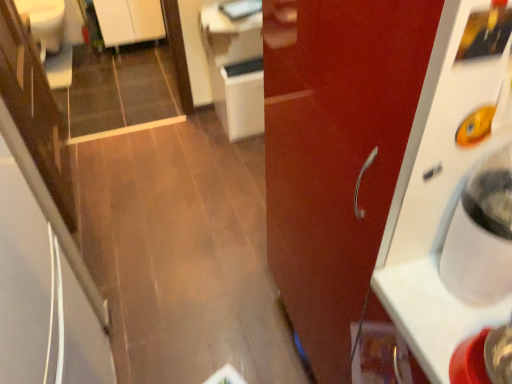
Question: Is glossy wood door at right a part of white glossy counter top at upper center?

Choices:
 (A) yes
 (B) no

Answer: (B)

Question: Can you confirm if white glossy counter top at upper center is positioned to the left of glossy wood door at right?

Choices:
 (A) no
 (B) yes

Answer: (B)

Question: Is white glossy counter top at upper center to the right of glossy wood door at right from the viewer's perspective?

Choices:
 (A) yes
 (B) no

Answer: (B)

Question: Is white glossy counter top at upper center thinner than glossy wood door at right?

Choices:
 (A) yes
 (B) no

Answer: (A)

Question: From the image's perspective, would you say white glossy counter top at upper center is shown under glossy wood door at right?

Choices:
 (A) no
 (B) yes

Answer: (A)

Question: Does point (479, 271) appear closer or farther from the camera than point (234, 89)?

Choices:
 (A) farther
 (B) closer

Answer: (B)

Question: Looking at their shapes, would you say white plastic water cooler at right is wider or thinner than white glossy cabinet at center, arranged as the second cabinetry when viewed from the back?

Choices:
 (A) wide
 (B) thin

Answer: (B)

Question: Is white plastic water cooler at right inside the boundaries of white glossy cabinet at center, the 1th cabinetry in the bottom-to-top sequence, or outside?

Choices:
 (A) outside
 (B) inside

Answer: (A)

Question: From a real-world perspective, is white plastic water cooler at right positioned above or below white glossy cabinet at center, the 1th cabinetry in the bottom-to-top sequence?

Choices:
 (A) above
 (B) below

Answer: (A)

Question: From a real-world perspective, is glossy wood door at right physically located above or below white plastic water cooler at right?

Choices:
 (A) below
 (B) above

Answer: (A)

Question: Considering the positions of point (384, 317) and point (490, 302), is point (384, 317) closer or farther from the camera than point (490, 302)?

Choices:
 (A) farther
 (B) closer

Answer: (A)

Question: Looking at their shapes, would you say glossy wood door at right is wider or thinner than white plastic water cooler at right?

Choices:
 (A) wide
 (B) thin

Answer: (A)

Question: Based on their positions, is glossy wood door at right located to the left or right of white plastic water cooler at right?

Choices:
 (A) right
 (B) left

Answer: (B)

Question: Is white glossy cabinet at upper left, which is the second cabinetry from front to back, bigger or smaller than white glossy cabinet at center, which is the 1th cabinetry in right-to-left order?

Choices:
 (A) small
 (B) big

Answer: (B)

Question: Is white glossy cabinet at upper left, which ranks as the 1th cabinetry in left-to-right order, to the left or to the right of white glossy cabinet at center, which is the 1th cabinetry in right-to-left order, in the image?

Choices:
 (A) left
 (B) right

Answer: (A)